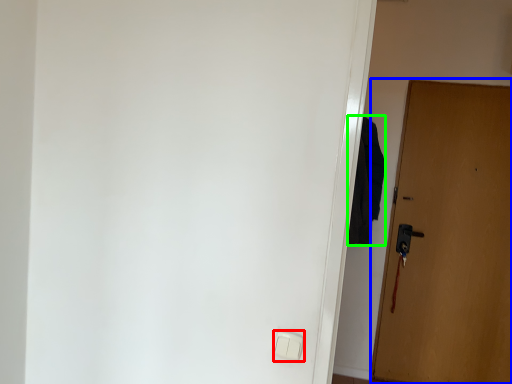
Question: Considering the real-world distances, which object is closest to light switch (highlighted by a red box)? door (highlighted by a blue box) or robe (highlighted by a green box).

Choices:
 (A) door
 (B) robe

Answer: (B)